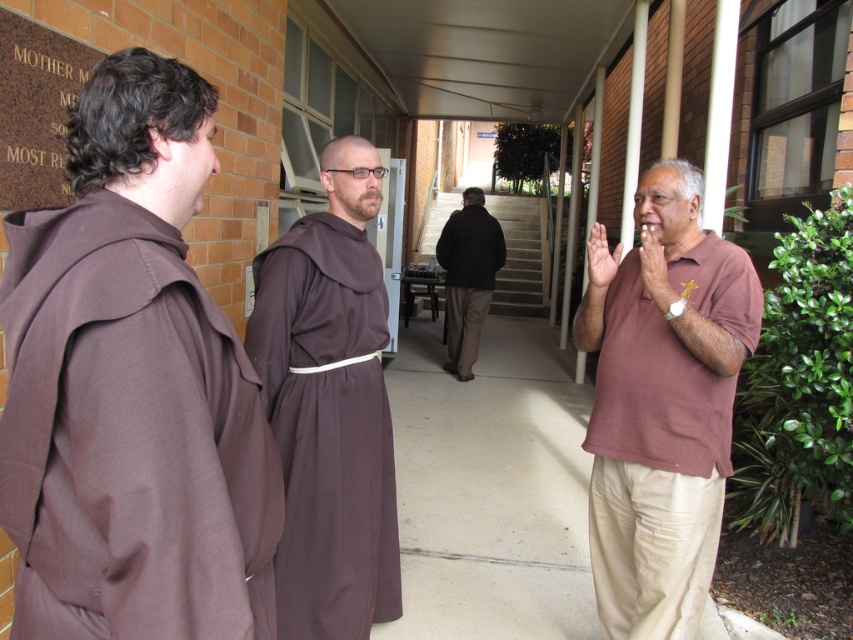
You are standing at the point with coordinates point (456, 316) and want to walk towards the point with coordinates point (321, 627). Which direction should you face to move directly towards it?

You should face northeast to move directly towards point (321, 627) from point (456, 316).

You are standing at the entrance of the building and want to approach the person wearing the brown cotton robe at left. According to the coordinates provided, in which direction should you move from your current position to reach them?

The brown cotton robe at left is located at point coordinates, so you should move towards the lower left direction from your current position at the entrance.

You are standing at the entrance of the building and see the brown clothed monk at center and the dark brown jacket at center. Which one is positioned lower in the image?

The brown clothed monk at center is positioned lower than the dark brown jacket at center in the image.